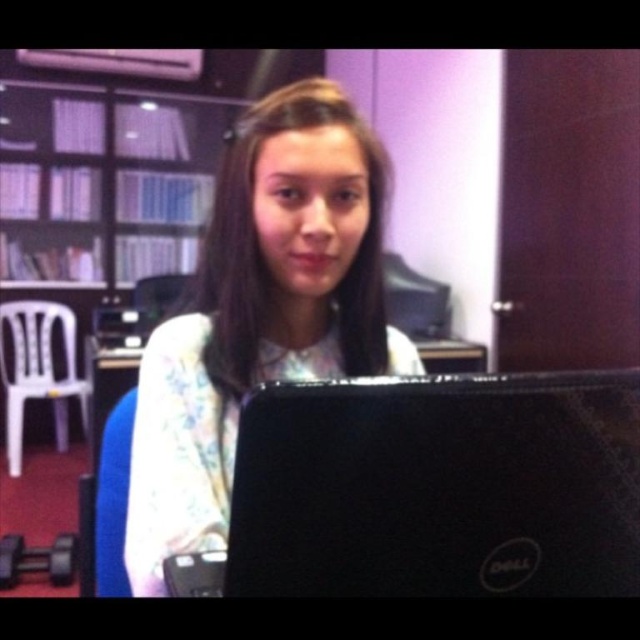
Which is in front, point (588, 420) or point (220, 536)?

Point (588, 420)

Is point (524, 412) farther from camera compared to point (262, 108)?

No, it is in front of (262, 108).

The image size is (640, 640). In order to click on black matte laptop at center in this screenshot , I will do `click(432, 490)`.

Is point (212, 257) positioned before point (12, 225)?

That is True.

Who is taller, white floral shirt at center or matte white bookshelf at upper left?

matte white bookshelf at upper left

Is point (225, 483) farther from viewer compared to point (1, 58)?

No, (225, 483) is closer to viewer.

The height and width of the screenshot is (640, 640). Identify the location of white floral shirt at center. (260, 310).

The height and width of the screenshot is (640, 640). What do you see at coordinates (432, 490) in the screenshot? I see `black matte laptop at center` at bounding box center [432, 490].

Between point (589, 538) and point (36, 216), which one is positioned behind?

The point (36, 216) is behind.

The image size is (640, 640). What are the coordinates of `black matte laptop at center` in the screenshot? It's located at (432, 490).